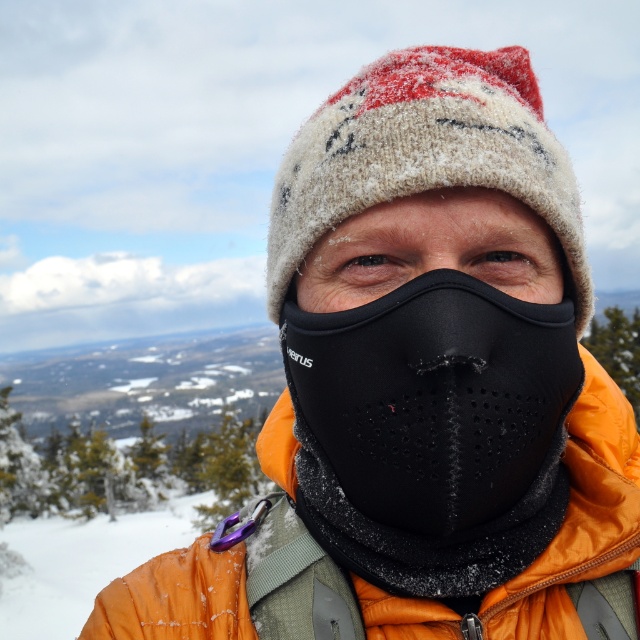
Between point (417, 531) and point (314, 253), which one is positioned in front?

Point (417, 531)

Locate an element on the screen. black neoprene mask at center is located at coordinates (433, 356).

The height and width of the screenshot is (640, 640). What do you see at coordinates (433, 356) in the screenshot?
I see `black neoprene mask at center` at bounding box center [433, 356].

Find the location of a particular element. Image resolution: width=640 pixels, height=640 pixels. black neoprene mask at center is located at coordinates (433, 356).

Between fuzzy woolen hat at center and black mesh mask at center, which one is positioned higher?

Result: fuzzy woolen hat at center

From the picture: Does fuzzy woolen hat at center appear on the right side of black mesh mask at center?

Yes, fuzzy woolen hat at center is to the right of black mesh mask at center.

Which is behind, point (442, 164) or point (300, 268)?

The point (300, 268) is more distant.

This screenshot has width=640, height=640. I want to click on fuzzy woolen hat at center, so click(x=424, y=154).